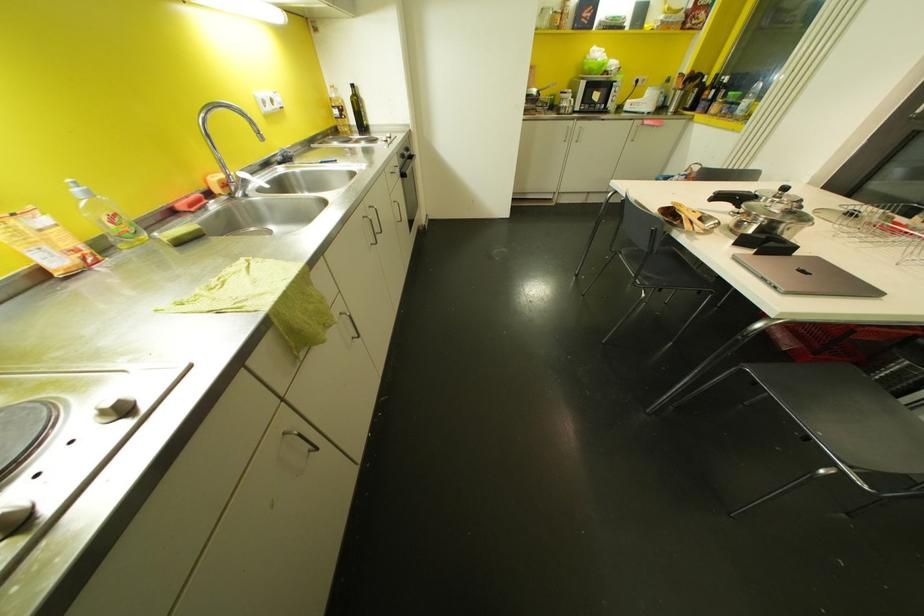
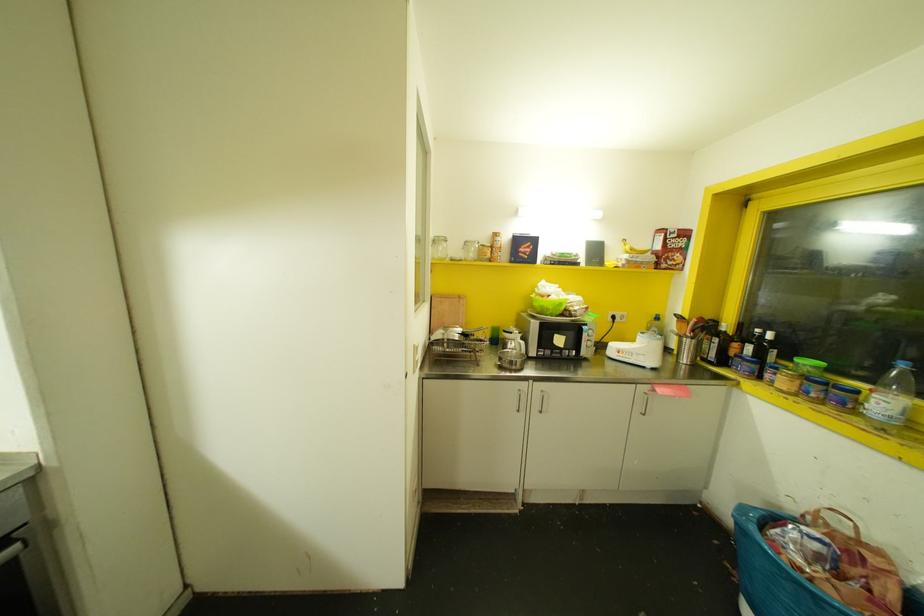
Find the pixel in the second image that matches (711,92) in the first image.

(748, 347)